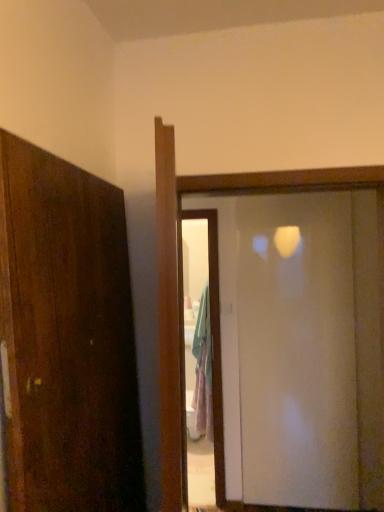
Question: From the image's perspective, relative to transparent glass screen door at center, is transparent glass door at center above or below?

Choices:
 (A) below
 (B) above

Answer: (B)

Question: Considering their positions, is transparent glass door at center located in front of or behind transparent glass screen door at center?

Choices:
 (A) behind
 (B) front

Answer: (B)

Question: Does point (342, 177) appear closer or farther from the camera than point (244, 467)?

Choices:
 (A) closer
 (B) farther

Answer: (A)

Question: Is transparent glass screen door at center in front of or behind transparent glass door at center in the image?

Choices:
 (A) behind
 (B) front

Answer: (A)

Question: Considering the positions of transparent glass screen door at center and transparent glass door at center in the image, is transparent glass screen door at center taller or shorter than transparent glass door at center?

Choices:
 (A) tall
 (B) short

Answer: (A)

Question: Is transparent glass screen door at center bigger or smaller than transparent glass door at center?

Choices:
 (A) big
 (B) small

Answer: (B)

Question: Which is correct: transparent glass screen door at center is inside transparent glass door at center, or outside of it?

Choices:
 (A) outside
 (B) inside

Answer: (A)